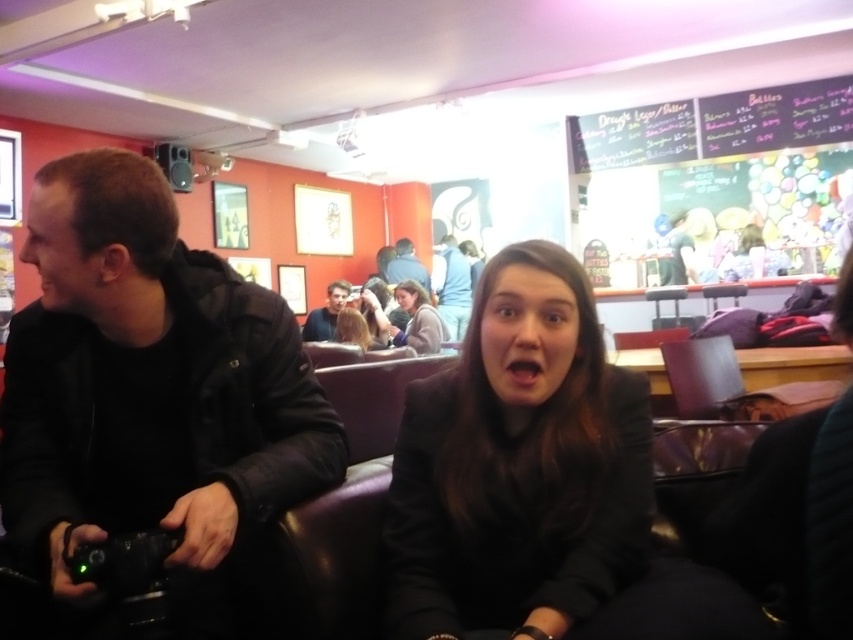
From the picture: Does chalkboard menu at upper right have a greater width compared to black chalkboard at upper center?

Correct, the width of chalkboard menu at upper right exceeds that of black chalkboard at upper center.

Can you confirm if chalkboard menu at upper right is positioned to the left of black chalkboard at upper center?

Incorrect, chalkboard menu at upper right is not on the left side of black chalkboard at upper center.

Who is more distant from viewer, (848, 131) or (666, 113)?

The point (666, 113) is behind.

The height and width of the screenshot is (640, 853). Identify the location of chalkboard menu at upper right. (776, 116).

Is matte gray jacket at center taller than blue denim jacket at center?

Incorrect, matte gray jacket at center's height is not larger of blue denim jacket at center's.

Does matte gray jacket at center appear on the left side of blue denim jacket at center?

No, matte gray jacket at center is not to the left of blue denim jacket at center.

Describe the element at coordinates (416, 320) in the screenshot. The image size is (853, 640). I see `matte gray jacket at center` at that location.

Image resolution: width=853 pixels, height=640 pixels. Find the location of `matte gray jacket at center`. matte gray jacket at center is located at coordinates (416, 320).

Which is in front, point (840, 131) or point (454, 240)?

Point (840, 131) is more forward.

This screenshot has width=853, height=640. Describe the element at coordinates (776, 116) in the screenshot. I see `chalkboard menu at upper right` at that location.

Find the location of `chalkboard menu at upper right`. chalkboard menu at upper right is located at coordinates (776, 116).